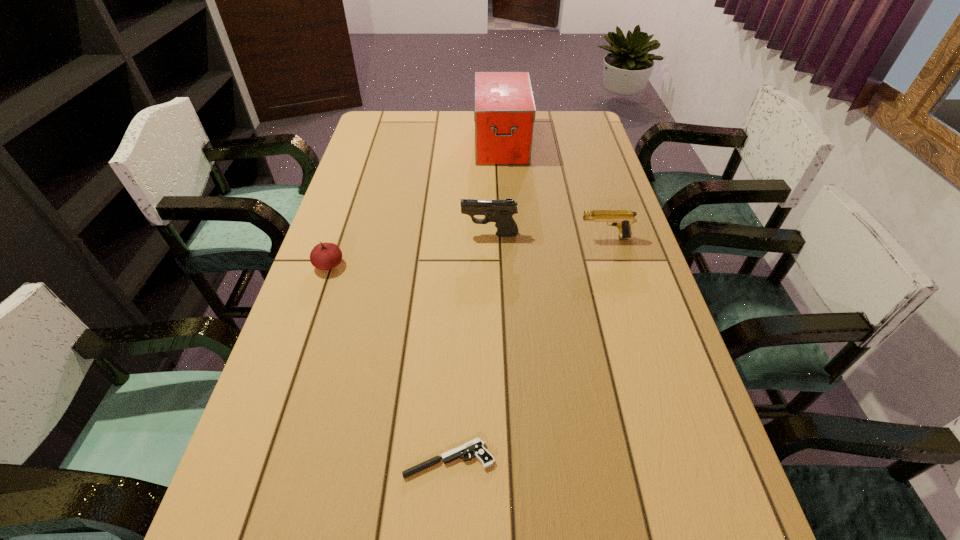
In order to click on object present at the far edge in this screenshot , I will do `click(504, 110)`.

Where is `object situated at the left edge`? The height and width of the screenshot is (540, 960). object situated at the left edge is located at coordinates (324, 256).

The width and height of the screenshot is (960, 540). In order to click on object that is at the right edge in this screenshot , I will do `click(622, 219)`.

At what (x,y) coordinates should I click in order to perform the action: click on vacant space at the far edge of the desktop. Please return your answer as a coordinate pair (x, y). Looking at the image, I should click on (455, 128).

This screenshot has height=540, width=960. What are the coordinates of `blank space at the left edge of the desktop` in the screenshot? It's located at (290, 419).

At what (x,y) coordinates should I click in order to perform the action: click on vacant area at the right edge. Please return your answer as a coordinate pair (x, y). This screenshot has width=960, height=540. Looking at the image, I should click on (594, 227).

In the image, there is a desktop. Where is `free space at the far right corner`? free space at the far right corner is located at coordinates (567, 120).

Find the location of a particular element. free spot between the second tallest object and the fourth tallest object is located at coordinates (410, 250).

Find the location of a particular element. This screenshot has height=540, width=960. unoccupied position between the leftmost object and the rightmost pistol is located at coordinates (468, 252).

You are a GUI agent. You are given a task and a screenshot of the screen. Output one action in this format:
    pyautogui.click(x=<x>, y=<y>)
    Task: Click on the unoccupied position between the rightmost pistol and the tallest pistol
    
    Given the screenshot: What is the action you would take?
    pyautogui.click(x=547, y=237)